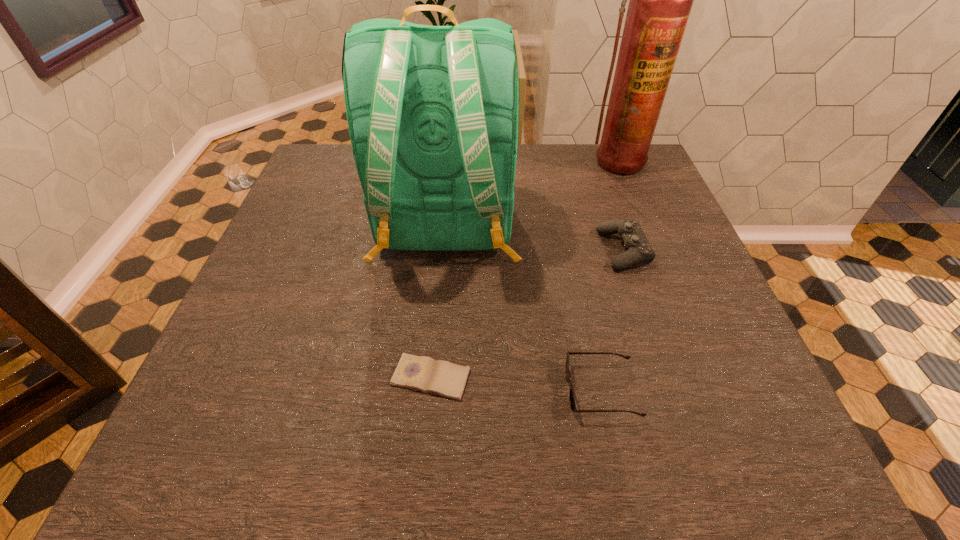
Identify the location of vacant space at the left edge. pyautogui.click(x=302, y=331).

Locate an element on the screen. vacant region at the right edge of the desktop is located at coordinates (612, 193).

Where is `vacant space in between the third tallest object and the farthest object`? vacant space in between the third tallest object and the farthest object is located at coordinates (619, 206).

Locate an element on the screen. vacant space that's between the third tallest object and the third object from left to right is located at coordinates (612, 321).

Where is `free spot between the backpack and the diary`? free spot between the backpack and the diary is located at coordinates (438, 303).

Image resolution: width=960 pixels, height=540 pixels. Find the location of `free area in between the third tallest object and the third object from right to left`. free area in between the third tallest object and the third object from right to left is located at coordinates (612, 321).

I want to click on vacant area that lies between the third object from left to right and the farthest object, so click(609, 276).

Locate an element on the screen. free space between the third tallest object and the fire extinguisher is located at coordinates (619, 206).

Image resolution: width=960 pixels, height=540 pixels. In order to click on unoccupied area between the third shortest object and the backpack in this screenshot , I will do `click(535, 239)`.

This screenshot has height=540, width=960. What are the coordinates of `free space between the control and the diary` in the screenshot? It's located at (527, 314).